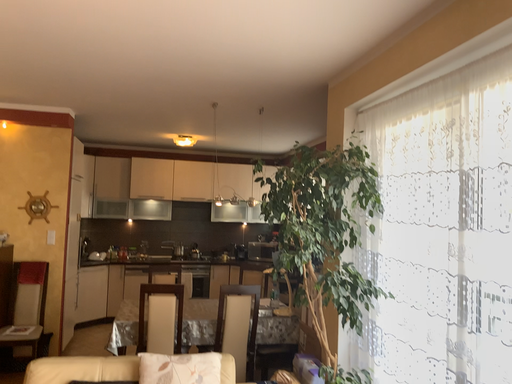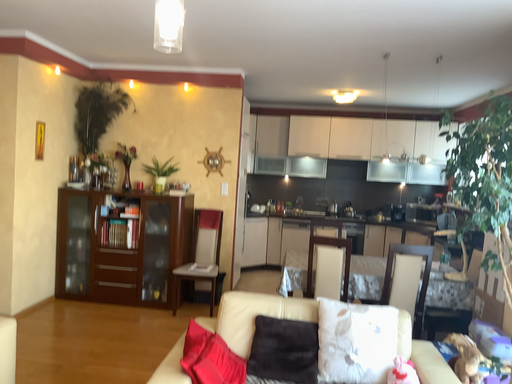
Question: How did the camera likely rotate when shooting the video?

Choices:
 (A) rotated right
 (B) rotated left

Answer: (B)